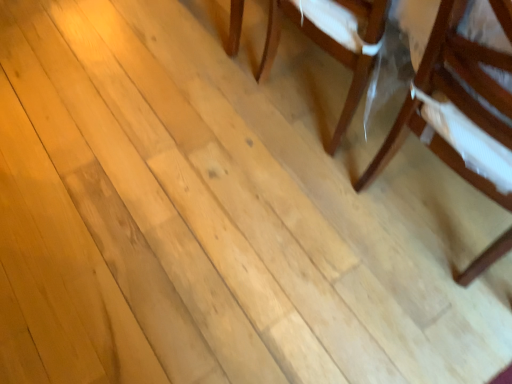
Measure the distance between point (365,11) and camera.

Point (365,11) is 3.39 feet from camera.

What is the approximate width of wooden chair at center?

wooden chair at center is 55.58 centimeters wide.

Where is `wooden chair at center`? This screenshot has height=384, width=512. wooden chair at center is located at coordinates (x=332, y=41).

What do you see at coordinates (332, 41) in the screenshot? The height and width of the screenshot is (384, 512). I see `wooden chair at center` at bounding box center [332, 41].

I want to click on wooden chair at center, so click(332, 41).